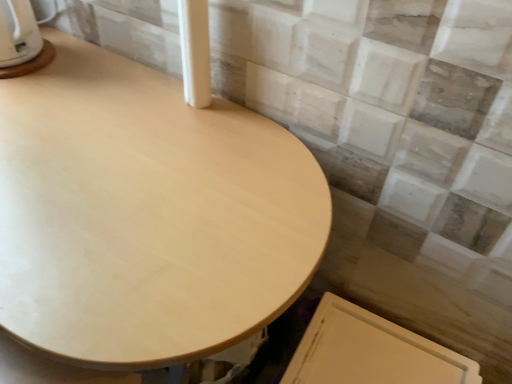
Find the location of a particular element. The width and height of the screenshot is (512, 384). vacant position to the left of white smooth pillar at upper center is located at coordinates (114, 91).